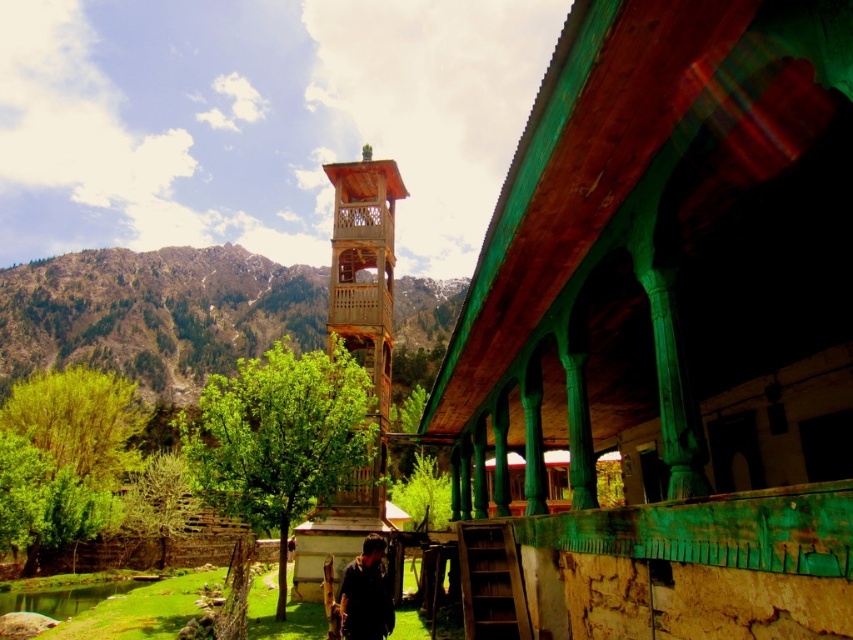
Is wooden lattice bell tower at center further to the viewer compared to dark blue shirt at center?

Yes, wooden lattice bell tower at center is further from the viewer.

Who is positioned more to the left, wooden lattice bell tower at center or dark blue shirt at center?

wooden lattice bell tower at center

Image resolution: width=853 pixels, height=640 pixels. What are the coordinates of `wooden lattice bell tower at center` in the screenshot? It's located at (357, 356).

Is green painted wood at center wider than dark blue shirt at center?

Correct, the width of green painted wood at center exceeds that of dark blue shirt at center.

Does green painted wood at center appear on the right side of dark blue shirt at center?

Indeed, green painted wood at center is positioned on the right side of dark blue shirt at center.

The width and height of the screenshot is (853, 640). I want to click on green painted wood at center, so click(671, 324).

Does green painted wood at center appear on the right side of wooden lattice bell tower at center?

Correct, you'll find green painted wood at center to the right of wooden lattice bell tower at center.

Does green painted wood at center have a greater width compared to wooden lattice bell tower at center?

Indeed, green painted wood at center has a greater width compared to wooden lattice bell tower at center.

Find the location of a particular element. The height and width of the screenshot is (640, 853). green painted wood at center is located at coordinates (671, 324).